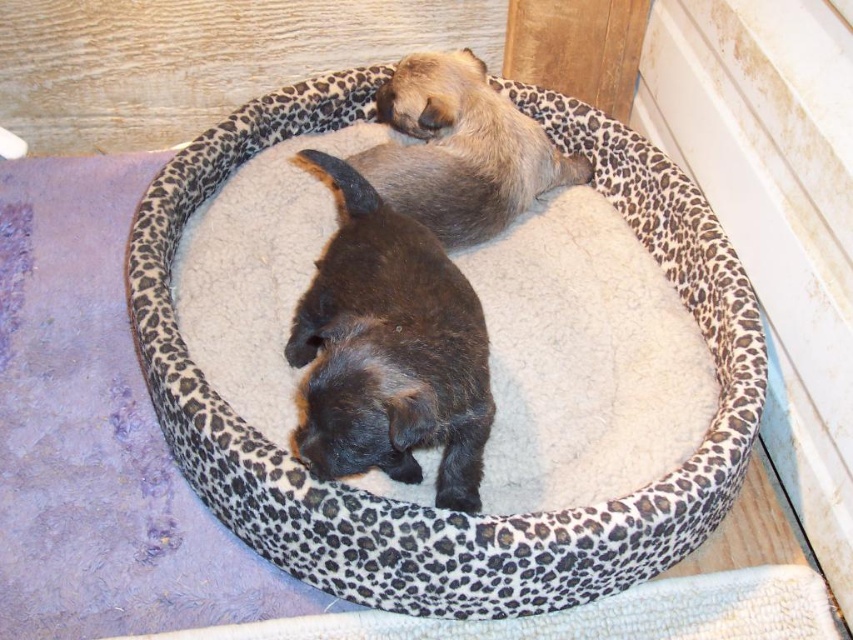
Question: In this image, where is black fur dog at center located relative to fuzzy beige dog at upper center?

Choices:
 (A) below
 (B) above

Answer: (A)

Question: Which of these objects is positioned farthest from the leopard print fabric cat bed at center?

Choices:
 (A) black fur dog at center
 (B) fuzzy beige dog at upper center

Answer: (B)

Question: Is black fur dog at center bigger than fuzzy beige dog at upper center?

Choices:
 (A) yes
 (B) no

Answer: (A)

Question: Is leopard print fabric cat bed at center to the left of fuzzy beige dog at upper center from the viewer's perspective?

Choices:
 (A) no
 (B) yes

Answer: (B)

Question: Which object appears farthest from the camera in this image?

Choices:
 (A) fuzzy beige dog at upper center
 (B) leopard print fabric cat bed at center

Answer: (A)

Question: Among these objects, which one is farthest from the camera?

Choices:
 (A) leopard print fabric cat bed at center
 (B) fuzzy beige dog at upper center
 (C) black fur dog at center

Answer: (B)